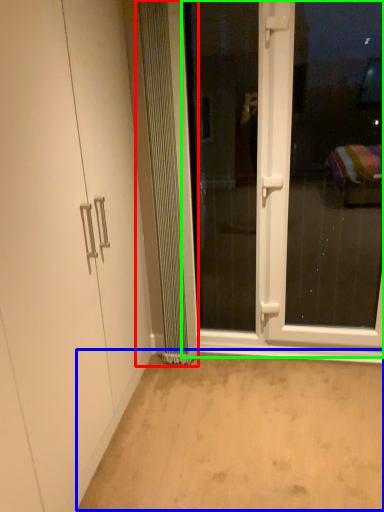
Question: Which object is positioned closest to radiator (highlighted by a red box)? Select from plain (highlighted by a blue box) and screen door (highlighted by a green box).

Choices:
 (A) plain
 (B) screen door

Answer: (B)